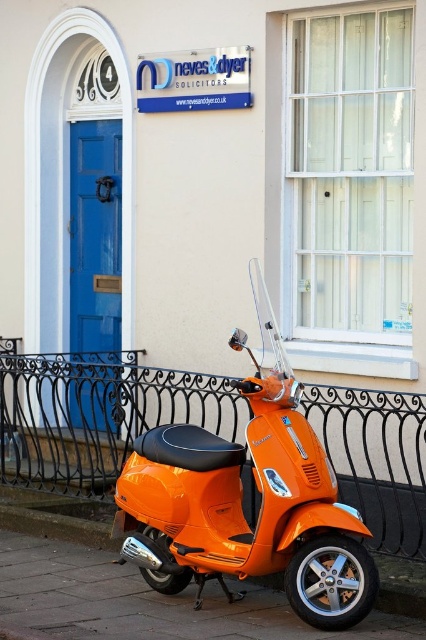
You are standing at the entrance of the building and want to take a photo of the black wrought iron fence at lower center. If your camera has a maximum focus range of 5 meters, will you be able to capture the fence clearly?

The black wrought iron fence at lower center is 5.73 meters away from the camera, which exceeds the maximum focus range of 5 meters. Therefore, the camera cannot capture the fence clearly at this distance.

You are a delivery person who needs to park your scooter between the orange glossy scooter at center and the orange matte scooter at lower center. The minimum distance required for parking is 24 inches. Can you safely park your scooter there?

The distance between the orange glossy scooter at center and the orange matte scooter at lower center is 23.80 inches, which is less than the required 24 inches. Therefore, you cannot safely park your scooter there.

You are a delivery person approaching the building and need to park your scooter. You see the black wrought iron fence at lower center and the orange matte scooter at lower center. Which object is closer to you as you approach the building?

The black wrought iron fence at lower center is closer to you because it is positioned further to the viewer than the orange matte scooter at lower center, meaning it appears nearer in the scene.